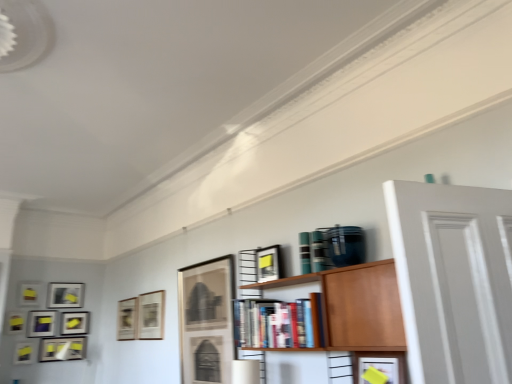
What do you see at coordinates (42, 323) in the screenshot?
I see `matte black picture frame at lower left, positioned as the 4th picture frame in left-to-right order` at bounding box center [42, 323].

Describe the element at coordinates (16, 322) in the screenshot. I see `matte black picture frame at lower left, which ranks as the 1th picture frame in left-to-right order` at that location.

I want to click on matte black picture frame at left, which is the 5th picture frame in left-to-right order, so click(65, 295).

You are a GUI agent. You are given a task and a screenshot of the screen. Output one action in this format:
    pyautogui.click(x=<x>, y=<y>)
    Task: Click on the matte black picture frame at center, the 9th picture frame in the left-to-right sequence
    Image resolution: width=512 pixels, height=384 pixels.
    Given the screenshot: What is the action you would take?
    pyautogui.click(x=151, y=315)

What do you see at coordinates (151, 315) in the screenshot?
I see `matte black picture frame at center, the 9th picture frame in the left-to-right sequence` at bounding box center [151, 315].

Where is `matte black picture frame at lower left, which appears as the eighth picture frame when viewed from the right`? The image size is (512, 384). matte black picture frame at lower left, which appears as the eighth picture frame when viewed from the right is located at coordinates (42, 323).

Looking at this image, from a real-world perspective, which object stands above the other?

matte black picture frame at left, positioned as the seventh picture frame in right-to-left order, from a real-world perspective.

Where is `the 7th picture frame below the matte black picture frame at left, positioned as the seventh picture frame in right-to-left order (from a real-world perspective)`? The height and width of the screenshot is (384, 512). the 7th picture frame below the matte black picture frame at left, positioned as the seventh picture frame in right-to-left order (from a real-world perspective) is located at coordinates (206, 320).

Which is more to the left, matte black picture frame at left, which is the 5th picture frame in left-to-right order, or matte glass picture frame at center, the second picture frame when ordered from right to left?

matte black picture frame at left, which is the 5th picture frame in left-to-right order.

From the image's perspective, would you say matte black picture frame at left, which is the 5th picture frame in left-to-right order, is shown under matte glass picture frame at center, which ranks as the tenth picture frame in left-to-right order?

Yes, from the image's perspective, matte black picture frame at left, which is the 5th picture frame in left-to-right order, is beneath matte glass picture frame at center, which ranks as the tenth picture frame in left-to-right order.

Could you tell me if matte glass picture frame at center, the second picture frame when ordered from right to left, is turned towards matte black picture frame at lower left, positioned as the 4th picture frame in left-to-right order?

No, matte glass picture frame at center, the second picture frame when ordered from right to left, does not turn towards matte black picture frame at lower left, positioned as the 4th picture frame in left-to-right order.

Is matte black picture frame at lower left, which appears as the eighth picture frame when viewed from the right, completely or partially inside matte glass picture frame at center, which ranks as the tenth picture frame in left-to-right order?

Definitely not — matte black picture frame at lower left, which appears as the eighth picture frame when viewed from the right, is not inside matte glass picture frame at center, which ranks as the tenth picture frame in left-to-right order.

From the image's perspective, who appears lower, matte glass picture frame at center, the second picture frame when ordered from right to left, or matte black picture frame at lower left, which appears as the eighth picture frame when viewed from the right?

matte black picture frame at lower left, which appears as the eighth picture frame when viewed from the right.

Measure the distance from matte glass picture frame at center, which ranks as the tenth picture frame in left-to-right order, to matte black picture frame at lower left, positioned as the 4th picture frame in left-to-right order.

A distance of 9.38 feet exists between matte glass picture frame at center, which ranks as the tenth picture frame in left-to-right order, and matte black picture frame at lower left, positioned as the 4th picture frame in left-to-right order.

Can you tell me how much matte black picture frame at lower left, which appears as the eighth picture frame when viewed from the right, and wooden bookshelf at center differ in facing direction?

The angular difference between matte black picture frame at lower left, which appears as the eighth picture frame when viewed from the right, and wooden bookshelf at center is 90 degrees.

Is matte black picture frame at lower left, which appears as the eighth picture frame when viewed from the right, shorter than wooden bookshelf at center?

Yes.

From a real-world perspective, between matte black picture frame at lower left, which appears as the eighth picture frame when viewed from the right, and wooden bookshelf at center, who is vertically lower?

wooden bookshelf at center is physically lower.

Does point (52, 311) lie behind point (356, 286)?

Yes, it is.

From the image's perspective, is matte black picture frame at center, marked as the fourth picture frame in a right-to-left arrangement, below matte black picture frame at lower left, which appears as the 3th picture frame when viewed from the left?

No, from the image's perspective, matte black picture frame at center, marked as the fourth picture frame in a right-to-left arrangement, is not beneath matte black picture frame at lower left, which appears as the 3th picture frame when viewed from the left.

In the scene shown: How different are the orientations of matte black picture frame at center, the 8th picture frame positioned from the left, and matte black picture frame at lower left, which ranks as the ninth picture frame in right-to-left order, in degrees?

matte black picture frame at center, the 8th picture frame positioned from the left, and matte black picture frame at lower left, which ranks as the ninth picture frame in right-to-left order, are facing 91.2 degrees away from each other.

Could you tell me if matte black picture frame at center, the 8th picture frame positioned from the left, is facing matte black picture frame at lower left, which ranks as the ninth picture frame in right-to-left order?

No, matte black picture frame at center, the 8th picture frame positioned from the left, is not facing towards matte black picture frame at lower left, which ranks as the ninth picture frame in right-to-left order.

Which is behind, point (271, 267) or point (34, 289)?

The point (34, 289) is farther from the camera.

From a real-world perspective, is matte black picture frame at center, which ranks as the eleventh picture frame in left-to-right order, on matte black picture frame at upper left, the tenth picture frame when ordered from right to left?

No, from a real-world perspective, matte black picture frame at center, which ranks as the eleventh picture frame in left-to-right order, is not on top of matte black picture frame at upper left, the tenth picture frame when ordered from right to left.

Starting from the matte black picture frame at center, positioned as the first picture frame in right-to-left order, which picture frame is the 9th one to the left? Please provide its 2D coordinates.

[(30, 294)]

From a real-world perspective, which picture frame is the 8th one above the matte glass picture frame at center, the second picture frame when ordered from right to left? Please provide its 2D coordinates.

[(30, 294)]

Would you say matte black picture frame at upper left, which is counted as the second picture frame, starting from the left, is part of matte glass picture frame at center, which ranks as the tenth picture frame in left-to-right order,'s contents?

No, matte black picture frame at upper left, which is counted as the second picture frame, starting from the left, is not inside matte glass picture frame at center, which ranks as the tenth picture frame in left-to-right order.

Considering the positions of points (181, 330) and (40, 292), is point (181, 330) farther from camera compared to point (40, 292)?

No, (181, 330) is in front of (40, 292).

How many degrees apart are the facing directions of matte glass picture frame at center, which ranks as the tenth picture frame in left-to-right order, and matte black picture frame at upper left, the tenth picture frame when ordered from right to left?

91.7 degrees.

From the image's perspective, which object appears higher, matte black picture frame at upper left, the tenth picture frame when ordered from right to left, or wooden bookshelf at center?

wooden bookshelf at center appears higher in the image.

Based on the photo, is matte black picture frame at upper left, the tenth picture frame when ordered from right to left, not near wooden bookshelf at center?

Yes, matte black picture frame at upper left, the tenth picture frame when ordered from right to left, and wooden bookshelf at center are quite far apart.

Does matte black picture frame at upper left, which is counted as the second picture frame, starting from the left, turn towards wooden bookshelf at center?

Yes, matte black picture frame at upper left, which is counted as the second picture frame, starting from the left, is turned towards wooden bookshelf at center.

From the picture: From a real-world perspective, is matte black picture frame at upper left, which is counted as the second picture frame, starting from the left, positioned under wooden bookshelf at center based on gravity?

Incorrect, from a real-world perspective, matte black picture frame at upper left, which is counted as the second picture frame, starting from the left, is higher than wooden bookshelf at center.

Which picture frame is the 8th one when counting from the back of the matte glass picture frame at center, the second picture frame when ordered from right to left? Please provide its 2D coordinates.

[(65, 295)]

Locate an element on the screen. This screenshot has width=512, height=384. picture frame that is the 6th object located above the matte black picture frame at lower left, which appears as the eighth picture frame when viewed from the right (from the image's perspective) is located at coordinates (206, 320).

Which object lies nearer to the anchor point wooden bookshelf at center, matte black picture frame at left, the seventh picture frame positioned from the left, or matte black picture frame at lower left, positioned as the 4th picture frame in left-to-right order?

Among the two, matte black picture frame at left, the seventh picture frame positioned from the left, is located nearer to wooden bookshelf at center.

When comparing their distances from matte black picture frame at center, positioned as the first picture frame in right-to-left order, does matte black picture frame at lower left, placed as the 6th picture frame when sorted from right to left, or wooden bookshelf at center seem closer?

wooden bookshelf at center.

Estimate the real-world distances between objects in this image. Which object is further from matte black picture frame at lower left, positioned as the 4th picture frame in left-to-right order, matte black picture frame at center, marked as the fourth picture frame in a right-to-left arrangement, or matte black picture frame at lower left, placed as the 6th picture frame when sorted from right to left?

matte black picture frame at center, marked as the fourth picture frame in a right-to-left arrangement.

From the image, which object appears to be farther from wooden bookshelf at center, matte black picture frame at upper left, the tenth picture frame when ordered from right to left, or matte black picture frame at lower left, positioned as the 4th picture frame in left-to-right order?

matte black picture frame at upper left, the tenth picture frame when ordered from right to left, lies further to wooden bookshelf at center than the other object.

Based on their spatial positions, is matte black picture frame at center, the 8th picture frame positioned from the left, or matte black picture frame at center, the 9th picture frame in the left-to-right sequence, further from matte black picture frame at lower left, which appears as the eighth picture frame when viewed from the right?

The object further to matte black picture frame at lower left, which appears as the eighth picture frame when viewed from the right, is matte black picture frame at center, the 9th picture frame in the left-to-right sequence.

Looking at the image, which one is located further to matte black picture frame at center, marked as the fourth picture frame in a right-to-left arrangement, matte black picture frame at upper left, the tenth picture frame when ordered from right to left, or wooden bookshelf at center?

wooden bookshelf at center is further to matte black picture frame at center, marked as the fourth picture frame in a right-to-left arrangement.

Looking at the image, which one is located further to matte black picture frame at lower left, positioned as the 4th picture frame in left-to-right order, matte black picture frame at lower left, which ranks as the 1th picture frame in left-to-right order, or matte black picture frame at center, marked as the fourth picture frame in a right-to-left arrangement?

matte black picture frame at center, marked as the fourth picture frame in a right-to-left arrangement, is positioned further to the anchor matte black picture frame at lower left, positioned as the 4th picture frame in left-to-right order.

Which object lies further to the anchor point matte black picture frame at upper left, which is counted as the second picture frame, starting from the left, matte glass picture frame at center, the second picture frame when ordered from right to left, or wooden bookshelf at center?

wooden bookshelf at center is positioned further to the anchor matte black picture frame at upper left, which is counted as the second picture frame, starting from the left.

Locate an element on the screen. The width and height of the screenshot is (512, 384). book between wooden bookshelf at center and matte black picture frame at lower left, placed as the 6th picture frame when sorted from right to left, from front to back is located at coordinates (279, 323).

Identify the location of book positioned between wooden bookshelf at center and matte black picture frame at left, the seventh picture frame positioned from the left, from near to far. (279, 323).

Where is `book located between wooden bookshelf at center and matte black picture frame at center, positioned as the first picture frame in right-to-left order, in the depth direction`? The width and height of the screenshot is (512, 384). book located between wooden bookshelf at center and matte black picture frame at center, positioned as the first picture frame in right-to-left order, in the depth direction is located at coordinates (279, 323).

At what (x,y) coordinates should I click in order to perform the action: click on book located between wooden bookshelf at center and matte black picture frame at lower left, positioned as the 4th picture frame in left-to-right order, in the depth direction. Please return your answer as a coordinate pair (x, y). The width and height of the screenshot is (512, 384). Looking at the image, I should click on (279, 323).